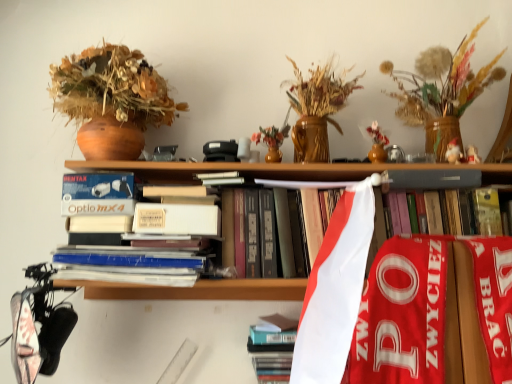
Question: Which is correct: hardcover book at center, marked as the 1th book in a bottom-to-top arrangement, is inside matte brown vase at upper left, or outside of it?

Choices:
 (A) inside
 (B) outside

Answer: (B)

Question: From a real-world perspective, is hardcover book at center, which ranks as the 2th book in top-to-bottom order, above or below matte brown vase at upper left?

Choices:
 (A) above
 (B) below

Answer: (B)

Question: Estimate the real-world distances between objects in this image. Which object is closer to the wooden vase with dried flowers at upper right?

Choices:
 (A) hardcover book at center, which is counted as the 1th book, starting from the top
 (B) hardcover book at center, marked as the 1th book in a bottom-to-top arrangement
 (C) matte brown vase at upper left

Answer: (A)

Question: Estimate the real-world distances between objects in this image. Which object is farther from the hardcover book at center, marked as the 1th book in a bottom-to-top arrangement?

Choices:
 (A) matte brown vase at upper left
 (B) wooden vase with dried flowers at upper right
 (C) hardcover book at center, which is counted as the 1th book, starting from the top

Answer: (B)